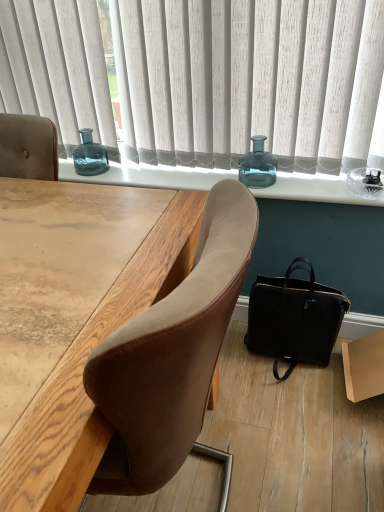
This screenshot has width=384, height=512. Identify the location of vacant region above teal glass vase at center (from a real-world perspective). click(230, 172).